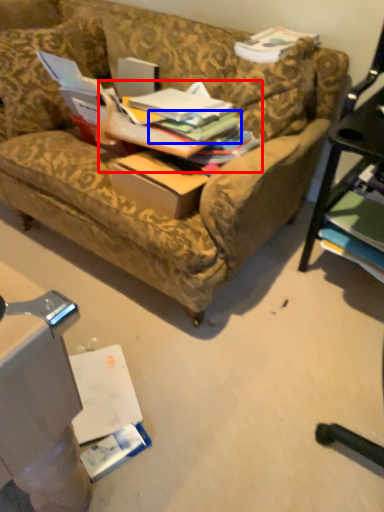
Question: Among these objects, which one is farthest to the camera, book (highlighted by a red box) or book (highlighted by a blue box)?

Choices:
 (A) book
 (B) book

Answer: (B)